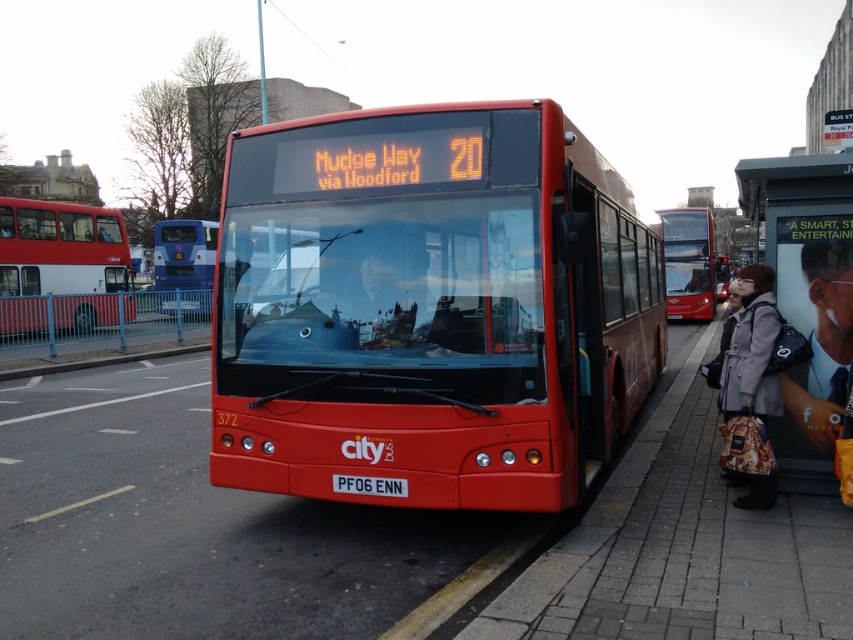
You are a pedestrian standing at the bus stop. You notice two points marked on the ground near the bus. The first point is at coordinate point(19, 620) and the second point is at coordinate point(769, 326). Which point is closer to you?

Point(19, 620) is in front of point(769, 326), so it is closer to you.

You are a pedestrian standing at the bus stop. You notice the shiny red bus at center and the smooth black tie at center. Which object is taller?

The shiny red bus at center is much taller than the smooth black tie at center.